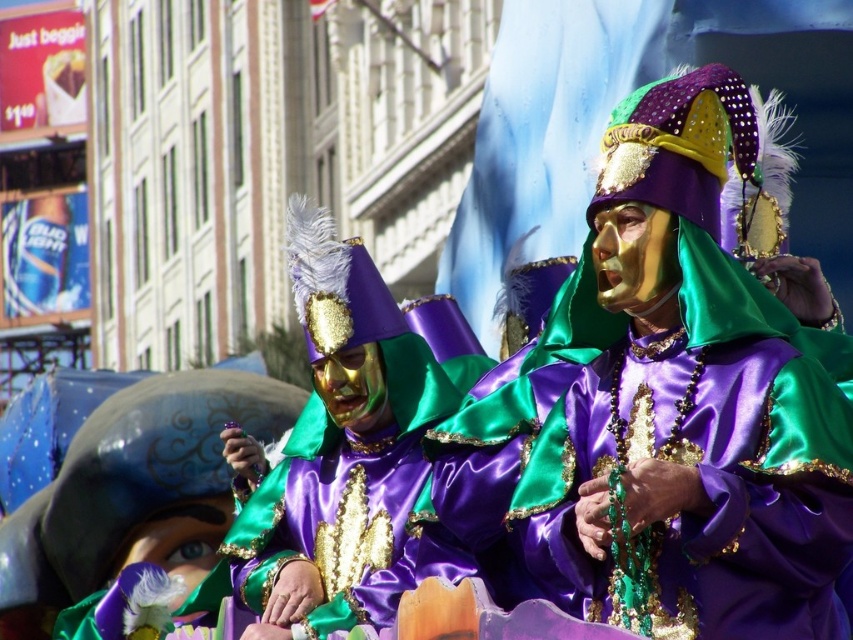
Question: Which object is closer to the camera taking this photo?

Choices:
 (A) satin/golden mask at center
 (B) purple satin mask at center

Answer: (B)

Question: Which object is farther from the camera taking this photo?

Choices:
 (A) satin/golden mask at center
 (B) purple satin mask at center

Answer: (A)

Question: Does purple satin mask at center appear over satin/golden mask at center?

Choices:
 (A) no
 (B) yes

Answer: (A)

Question: In this image, where is purple satin mask at center located relative to satin/golden mask at center?

Choices:
 (A) below
 (B) above

Answer: (A)

Question: Is purple satin mask at center smaller than satin/golden mask at center?

Choices:
 (A) yes
 (B) no

Answer: (A)